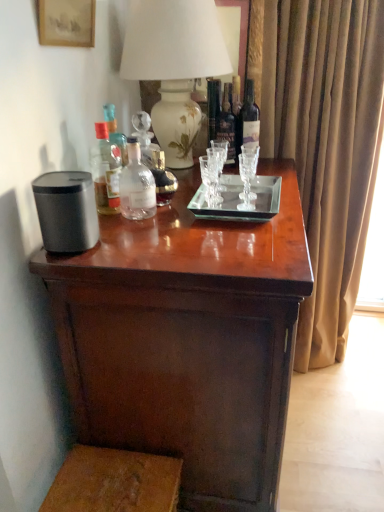
Question: Considering the positions of point (125, 33) and point (112, 150), is point (125, 33) closer or farther from the camera than point (112, 150)?

Choices:
 (A) closer
 (B) farther

Answer: (B)

Question: Considering the relative positions of white ceramic vase at upper center and translucent glass bottle at upper left, arranged as the first bottle when viewed from the left, in the image provided, is white ceramic vase at upper center to the left or to the right of translucent glass bottle at upper left, arranged as the first bottle when viewed from the left,?

Choices:
 (A) left
 (B) right

Answer: (B)

Question: Which object is positioned farthest from the dark glass bottle at upper right, marked as the fifth bottle in a left-to-right arrangement?

Choices:
 (A) clear glass bottle at center, which ranks as the third bottle in right-to-left order
 (B) dark glass bottle at center, marked as the 2th bottle in a right-to-left arrangement
 (C) brown velvet curtain at right
 (D) white ceramic vase at upper center
 (E) clear glass bottle at center, arranged as the fourth bottle when viewed from the right

Answer: (E)

Question: Which of these objects is positioned closest to the matte paper picture frame at upper left?

Choices:
 (A) white ceramic vase at upper center
 (B) dark wood table at center
 (C) brown velvet curtain at right
 (D) clear glass bottle at center, acting as the third bottle starting from the left
 (E) dark glass bottle at upper right, which is counted as the 1th bottle, starting from the right

Answer: (A)